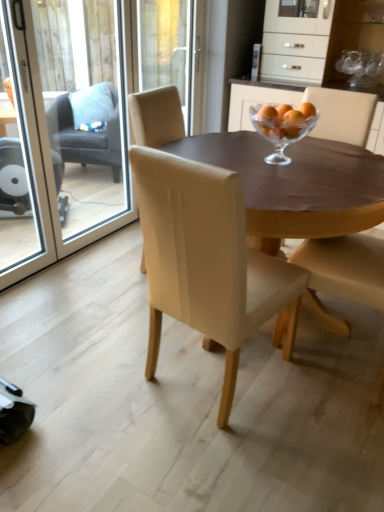
Question: From the image's perspective, relative to matte beige chair at center, the 3th chair when ordered from back to front, is transparent glass screen door at left, which appears as the first screen door when viewed from the right, above or below?

Choices:
 (A) below
 (B) above

Answer: (B)

Question: In terms of width, does transparent glass screen door at left, which appears as the first screen door when viewed from the right, look wider or thinner when compared to matte beige chair at center, which ranks as the 1th chair in right-to-left order?

Choices:
 (A) wide
 (B) thin

Answer: (B)

Question: Which of these objects is positioned farthest from the leather at center, placed as the 2th chair when sorted from left to right?

Choices:
 (A) matte beige chair at center, which is the 2th chair from front to back
 (B) clear glass bowl at center
 (C) transparent glass screen door at left, the second screen door positioned from the right
 (D) transparent glass screen door at left, which appears as the first screen door when viewed from the right
 (E) matte brown table at center

Answer: (D)

Question: Which is nearer to the clear glass bowl at center?

Choices:
 (A) beige leather chair at center, positioned as the 2th chair in right-to-left order
 (B) light gray fabric chair at left, marked as the first chair in a back-to-front arrangement
 (C) matte beige chair at center, which ranks as the 1th chair in right-to-left order
 (D) matte brown table at center
 (E) transparent glass screen door at left, which appears as the first screen door when viewed from the right

Answer: (D)